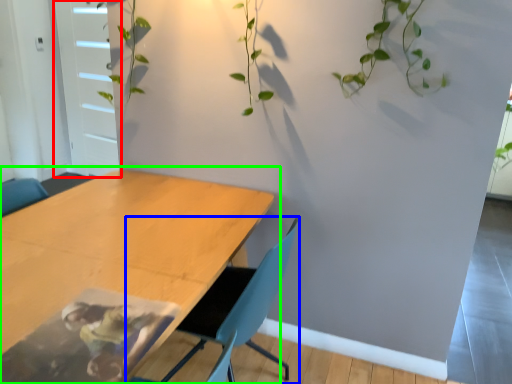
Question: Which is nearer to the glass door (highlighted by a red box)? chair (highlighted by a blue box) or table (highlighted by a green box).

Choices:
 (A) chair
 (B) table

Answer: (B)